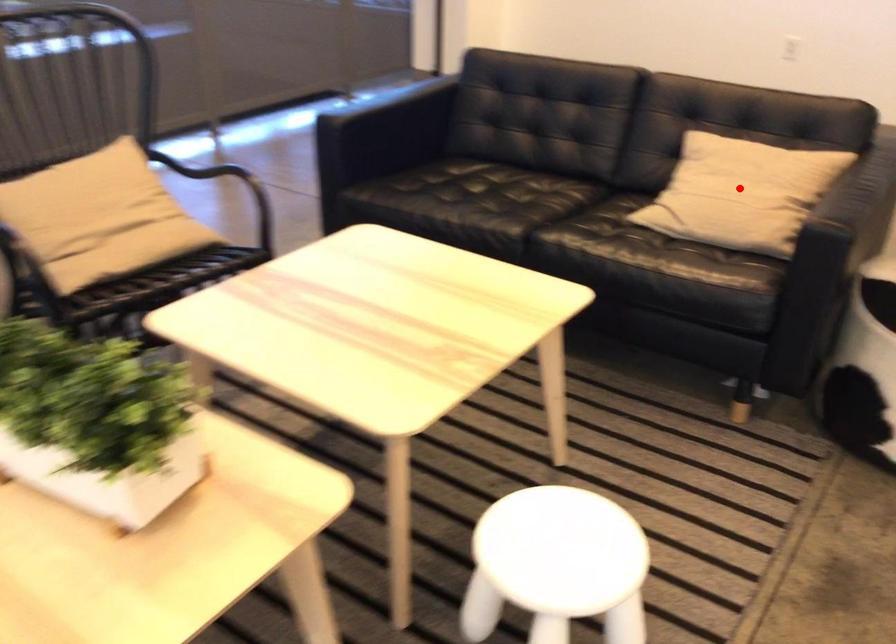
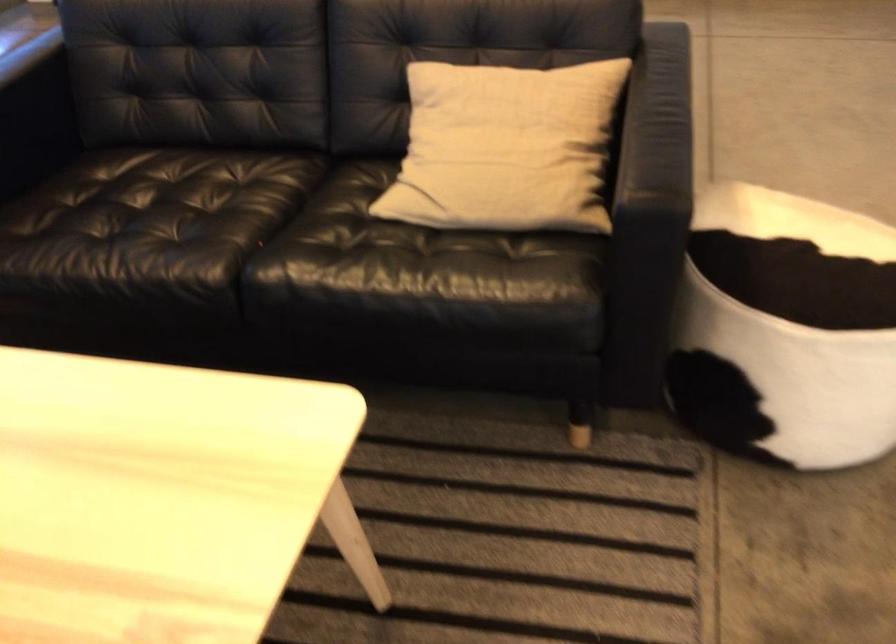
In the second image, find the point that corresponds to the highlighted location in the first image.

(505, 147)